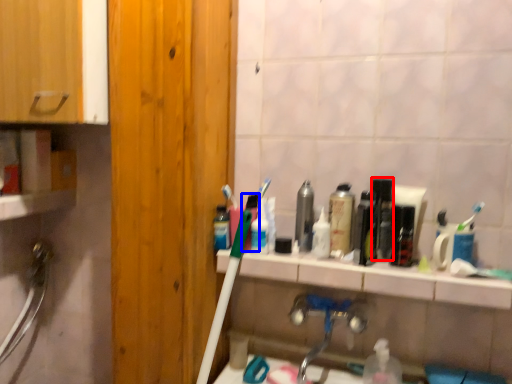
Question: Which point is further to the camera, mouthwash (highlighted by a red box) or mouthwash (highlighted by a blue box)?

Choices:
 (A) mouthwash
 (B) mouthwash

Answer: (B)